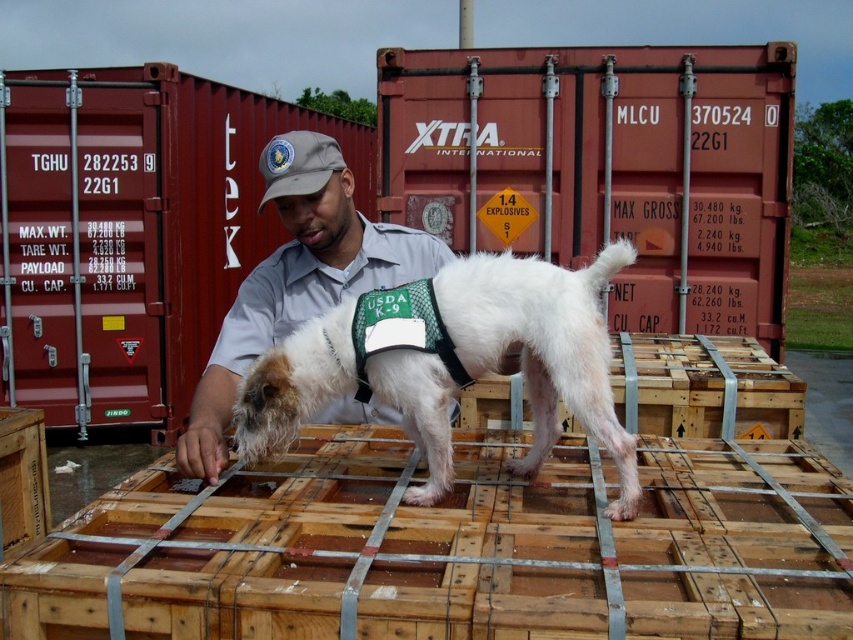
What are the coordinates of the red metal shipping container at center?

The red metal shipping container at center is located at coordinates point (x=606, y=168).

From the picture: You are a security officer who needs to ensure that the white fur dog at center can safely navigate around the red metal shipping container at center. Based on their sizes, can the dog easily move around the container without any difficulty?

The red metal shipping container at center has a larger size compared to the white fur dog at center. Since the container is bigger, the dog can easily move around it without any difficulty.